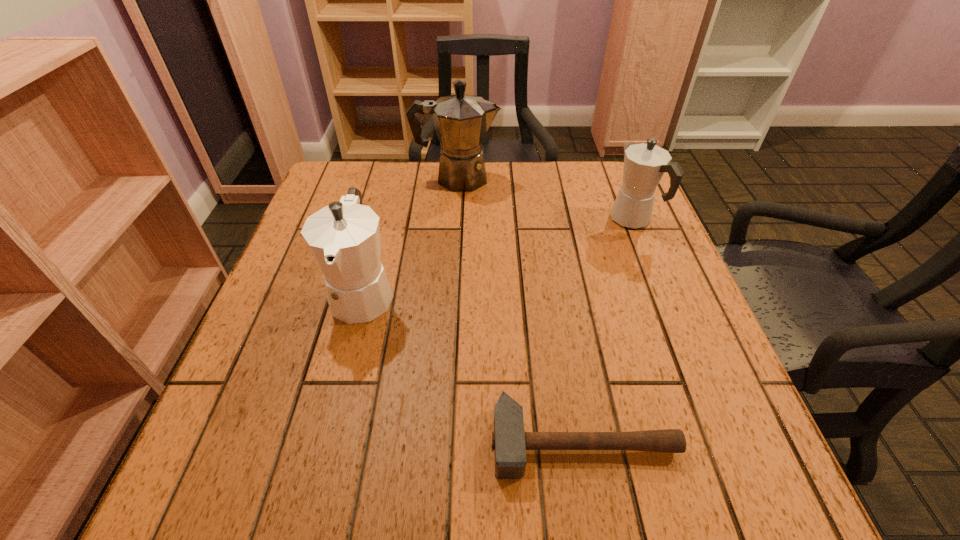
What are the coordinates of `object that is positioned at the left edge` in the screenshot? It's located at tap(344, 237).

You are a GUI agent. You are given a task and a screenshot of the screen. Output one action in this format:
    pyautogui.click(x=<x>, y=<y>)
    Task: Click on the coffeepot located at the right edge
    This screenshot has width=960, height=540.
    Given the screenshot: What is the action you would take?
    [x=644, y=164]

The image size is (960, 540). What are the coordinates of `hammer situated at the right edge` in the screenshot? It's located at (509, 441).

Locate an element on the screen. Image resolution: width=960 pixels, height=540 pixels. object at the far right corner is located at coordinates (644, 164).

Where is `object present at the near right corner`? object present at the near right corner is located at coordinates (509, 441).

The height and width of the screenshot is (540, 960). What are the coordinates of `free spot at the far edge of the desktop` in the screenshot? It's located at (462, 193).

This screenshot has height=540, width=960. In the image, there is a desktop. In order to click on vacant space at the left edge in this screenshot , I will do `click(315, 276)`.

The height and width of the screenshot is (540, 960). I want to click on free space at the right edge of the desktop, so click(622, 275).

At what (x,y) coordinates should I click in order to perform the action: click on vacant region at the far left corner. Please return your answer as a coordinate pair (x, y). Looking at the image, I should click on (356, 181).

Locate an element on the screen. blank space at the far right corner is located at coordinates (604, 211).